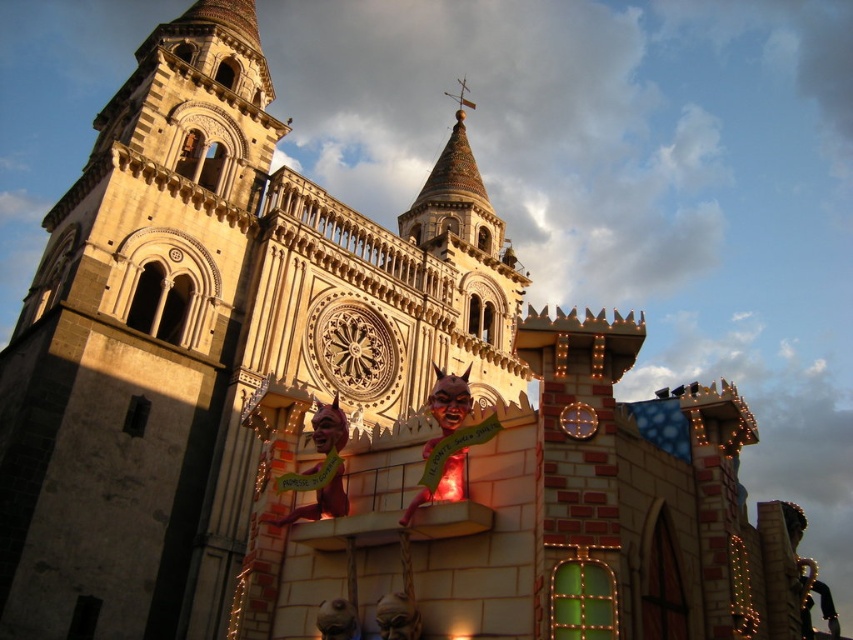
Which is in front, point (48, 282) or point (582, 412)?

Point (582, 412) is more forward.

Does beige stone tower at center have a lesser width compared to metallic gold clock at center?

No.

You are a GUI agent. You are given a task and a screenshot of the screen. Output one action in this format:
    pyautogui.click(x=<x>, y=<y>)
    Task: Click on the beige stone tower at center
    This screenshot has height=640, width=853.
    Given the screenshot: What is the action you would take?
    pyautogui.click(x=138, y=349)

At what (x,y) coordinates should I click in order to perform the action: click on beige stone tower at center. Please return your answer as a coordinate pair (x, y). Image resolution: width=853 pixels, height=640 pixels. Looking at the image, I should click on (138, 349).